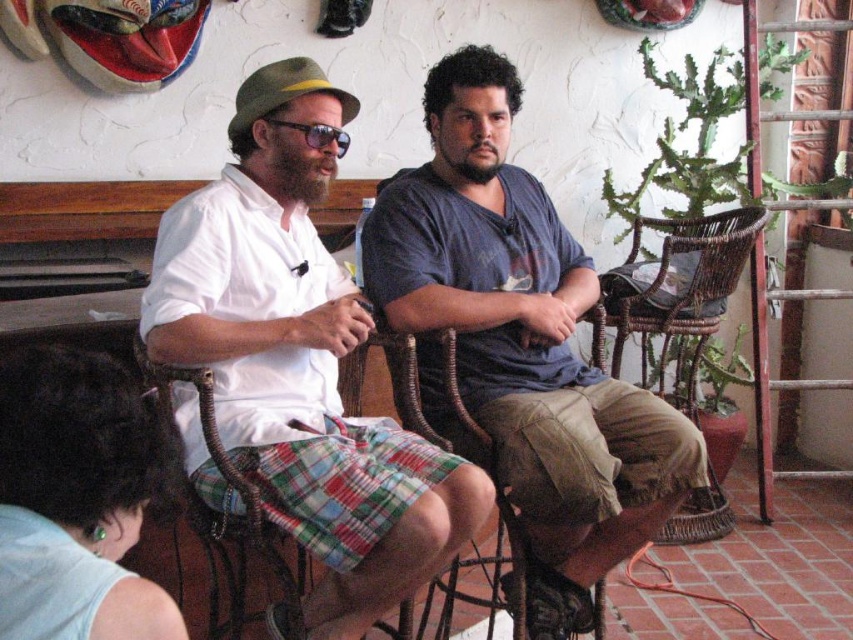
Consider the image. Can you confirm if blue cotton shirt at center is taller than woven rattan chair at right?

Correct, blue cotton shirt at center is much taller as woven rattan chair at right.

Is point (490, 262) farther from viewer compared to point (631, 282)?

No.

Which is in front, point (492, 58) or point (624, 268)?

Point (492, 58)

At what (x,y) coordinates should I click in order to perform the action: click on blue cotton shirt at center. Please return your answer as a coordinate pair (x, y). Looking at the image, I should click on (521, 344).

Does white cotton shirt at center have a larger size compared to plaid cotton kilt at center?

Yes.

Is white cotton shirt at center thinner than plaid cotton kilt at center?

In fact, white cotton shirt at center might be wider than plaid cotton kilt at center.

Measure the distance between point (334, 609) and camera.

Point (334, 609) and camera are 5.21 feet apart from each other.

At what (x,y) coordinates should I click in order to perform the action: click on white cotton shirt at center. Please return your answer as a coordinate pair (x, y). The width and height of the screenshot is (853, 640). Looking at the image, I should click on (300, 362).

Is green plaid shorts at lower left below woven rattan chair at right?

Yes.

This screenshot has height=640, width=853. What do you see at coordinates (74, 499) in the screenshot?
I see `green plaid shorts at lower left` at bounding box center [74, 499].

I want to click on green plaid shorts at lower left, so click(74, 499).